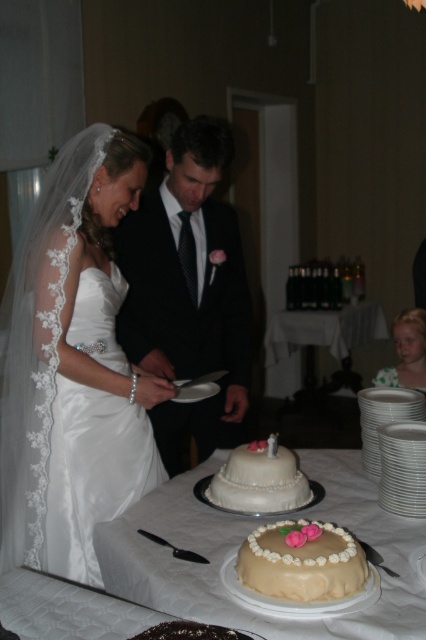
Can you confirm if white pearl cake at center is positioned to the left of polka dot dress at lower right?

Indeed, white pearl cake at center is positioned on the left side of polka dot dress at lower right.

Does white pearl cake at center have a larger size compared to polka dot dress at lower right?

Actually, white pearl cake at center might be smaller than polka dot dress at lower right.

Describe the element at coordinates (259, 480) in the screenshot. I see `white pearl cake at center` at that location.

The height and width of the screenshot is (640, 426). In order to click on white pearl cake at center in this screenshot , I will do `click(259, 480)`.

Which is behind, point (138, 522) or point (403, 310)?

The point (403, 310) is more distant.

In the scene shown: Who is shorter, creamy fondant cake at center or polka dot dress at lower right?

With less height is creamy fondant cake at center.

Does point (221, 598) come closer to viewer compared to point (391, 376)?

That is True.

Image resolution: width=426 pixels, height=640 pixels. What are the coordinates of `creamy fondant cake at center` in the screenshot? It's located at coord(241,541).

Between black satin suit at center and polka dot dress at lower right, which one appears on the left side from the viewer's perspective?

From the viewer's perspective, black satin suit at center appears more on the left side.

Measure the distance between point (215, 364) and camera.

The distance of point (215, 364) from camera is 2.26 meters.

The image size is (426, 640). I want to click on black satin suit at center, so click(x=189, y=291).